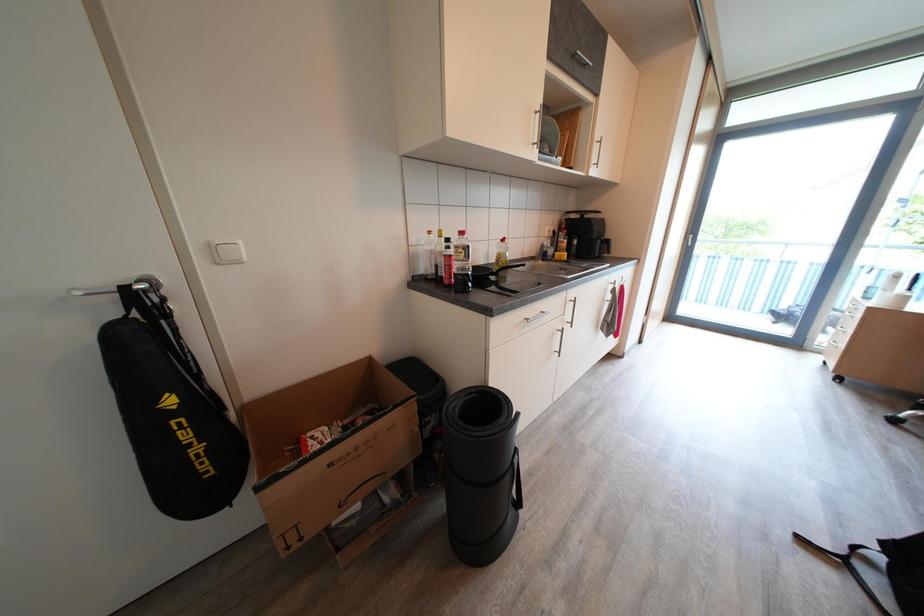
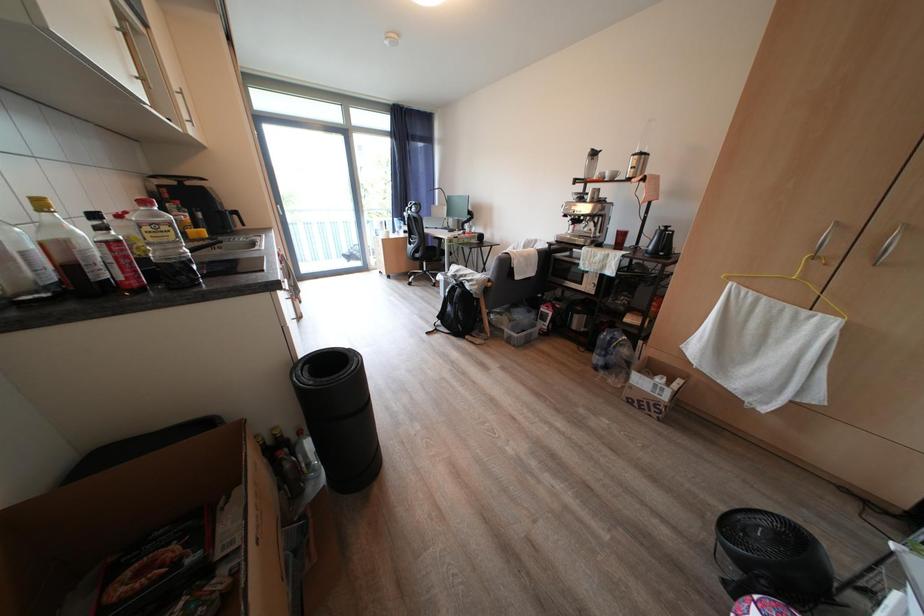
How did the camera likely rotate?

The rotation direction of the camera is right-down.